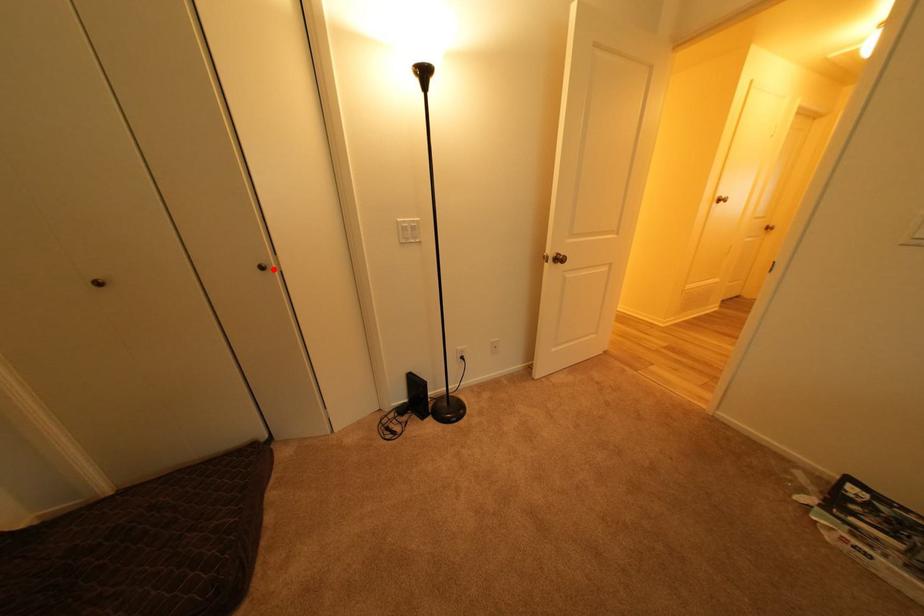
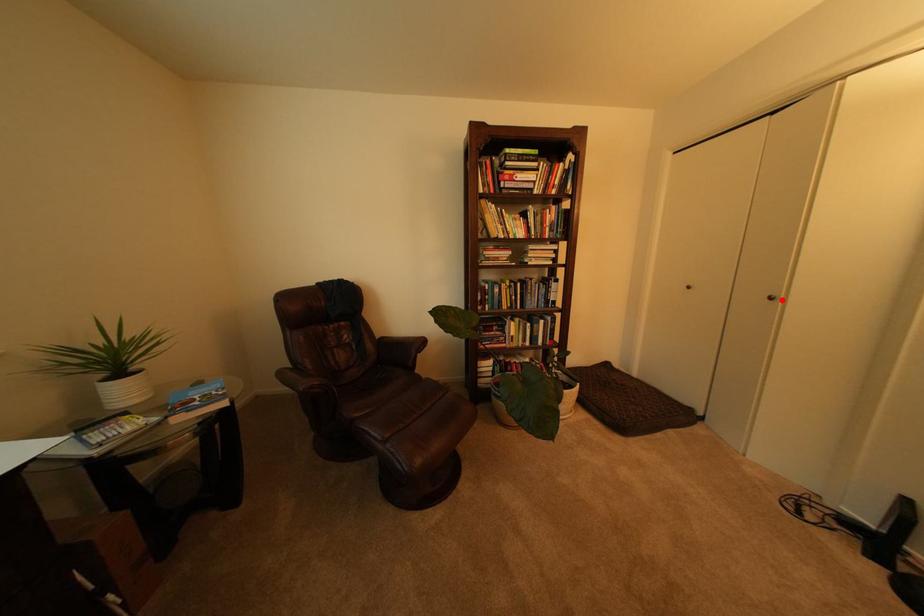
I am providing you with two images of the same scene from different viewpoints. A red point is marked on the first image and another point is marked on the second image. Is the red point in image1 aligned with the point shown in image2?

Yes